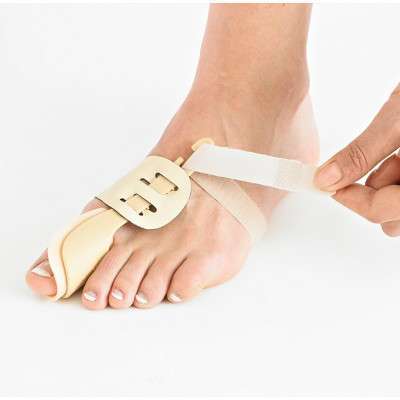
The width and height of the screenshot is (400, 400). Find the location of `cushioning`. cushioning is located at coordinates (55, 259).